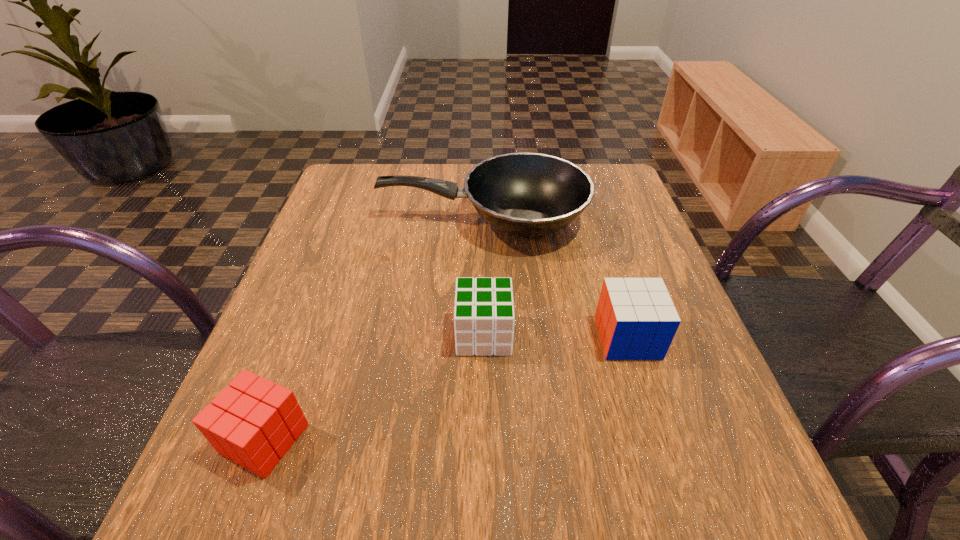
Locate an element on the screen. This screenshot has width=960, height=540. vacant space at the far edge of the desktop is located at coordinates (410, 164).

Image resolution: width=960 pixels, height=540 pixels. I want to click on vacant space at the near edge of the desktop, so pyautogui.click(x=561, y=489).

What are the coordinates of `blank area at the left edge` in the screenshot? It's located at (315, 301).

You are a GUI agent. You are given a task and a screenshot of the screen. Output one action in this format:
    pyautogui.click(x=<x>, y=<y>)
    Task: Click on the blank space at the right edge
    This screenshot has width=960, height=540.
    Given the screenshot: What is the action you would take?
    pyautogui.click(x=597, y=238)

This screenshot has width=960, height=540. I want to click on vacant space at the far left corner, so click(380, 190).

Locate an element on the screen. The image size is (960, 540). vacant region at the near left corner of the desktop is located at coordinates (286, 484).

Where is `blank region between the second cube from right to left and the rightmost cube`? This screenshot has width=960, height=540. blank region between the second cube from right to left and the rightmost cube is located at coordinates (556, 336).

You are a GUI agent. You are given a task and a screenshot of the screen. Output one action in this format:
    pyautogui.click(x=<x>, y=<y>)
    Task: Click on the free space that is in between the frying pan and the rightmost cube
    The image size is (960, 540).
    Given the screenshot: What is the action you would take?
    pyautogui.click(x=555, y=279)

At what (x,y) coordinates should I click in order to perform the action: click on empty location between the rightmost cube and the second cube from right to left. Please return your answer as a coordinate pair (x, y). Looking at the image, I should click on (556, 336).

Locate an element on the screen. The image size is (960, 540). free spot between the farthest object and the rightmost cube is located at coordinates (555, 279).